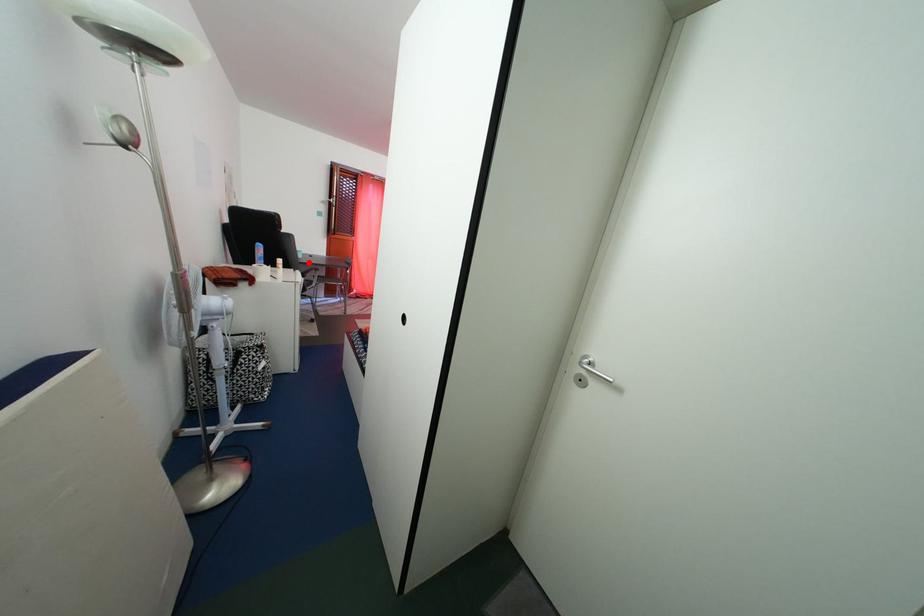
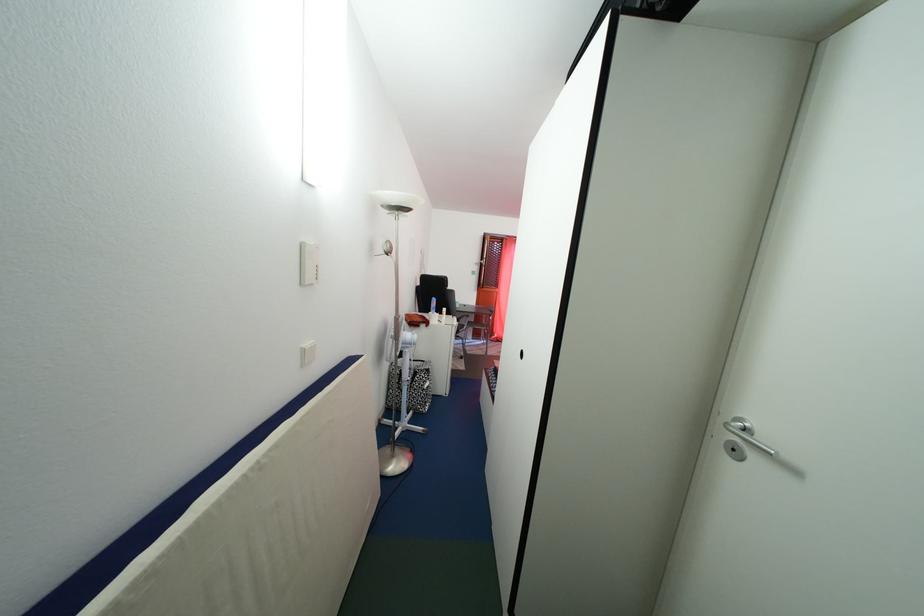
Question: I am providing you with two images of the same scene from different viewpoints. Given a red point in image1, look at the same physical point in image2. Is it:

Choices:
 (A) Closer to the viewpoint
 (B) Farther from the viewpoint

Answer: (B)